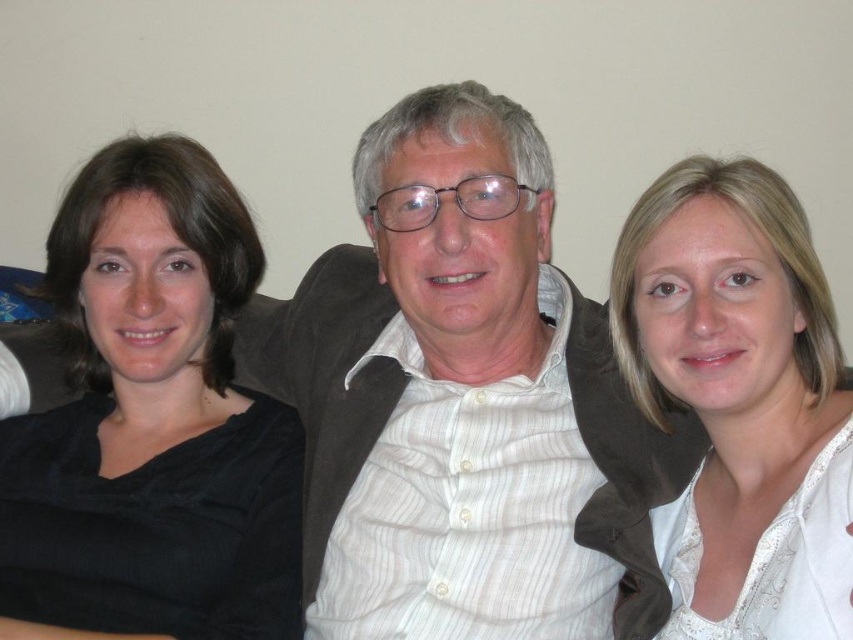
Does black matte shirt at left come in front of white lace blouse at right?

No, it is behind white lace blouse at right.

Can you confirm if black matte shirt at left is positioned to the right of white lace blouse at right?

No, black matte shirt at left is not to the right of white lace blouse at right.

Measure the distance between point (x=219, y=196) and camera.

Point (x=219, y=196) is 1.29 meters from camera.

Image resolution: width=853 pixels, height=640 pixels. In order to click on black matte shirt at left in this screenshot , I will do `click(152, 420)`.